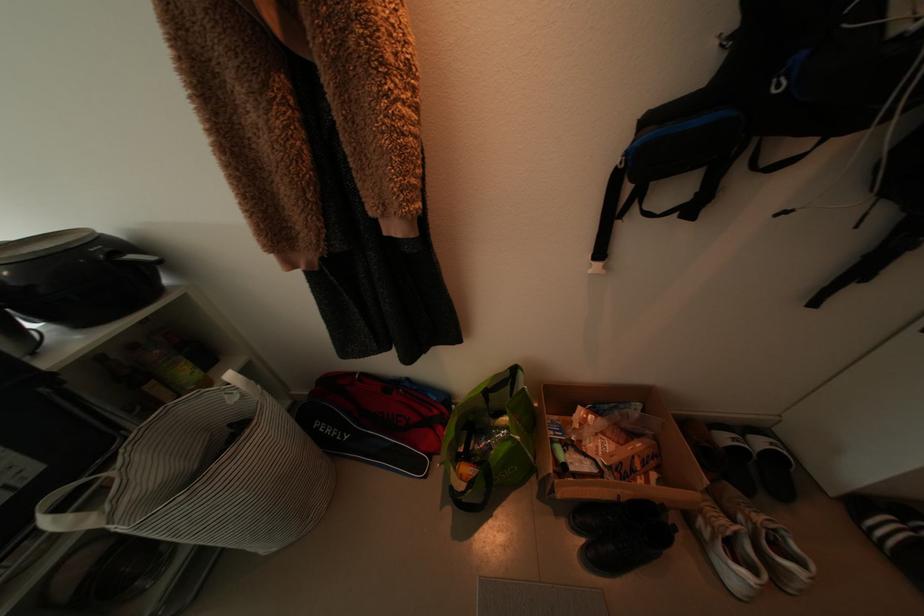
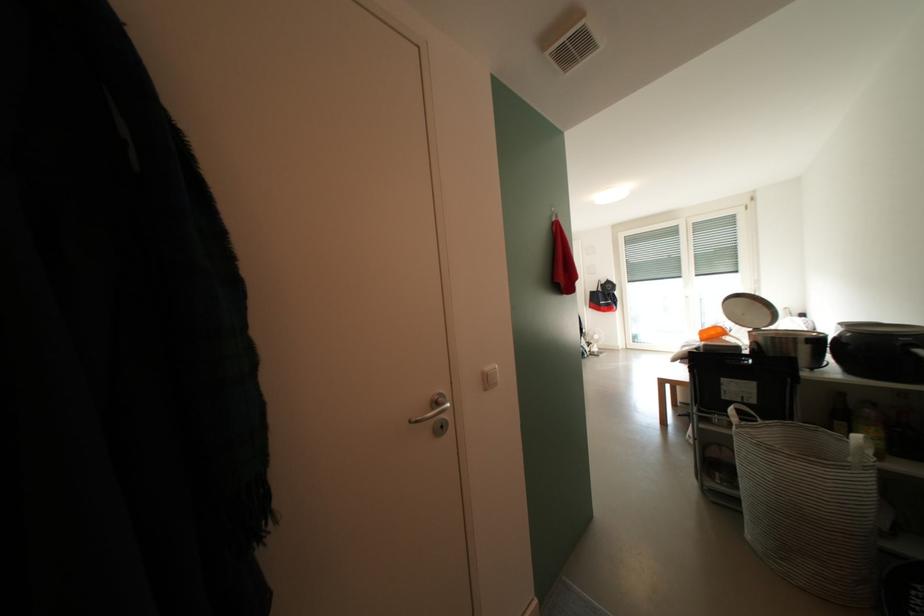
Where in the second image is the point corresponding to pixel 153 467 from the first image?

(779, 435)